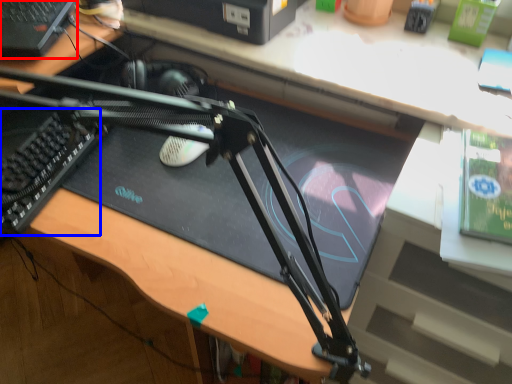
Question: Which object appears farthest to the camera in this image, computer (highlighted by a red box) or laptop keyboard (highlighted by a blue box)?

Choices:
 (A) computer
 (B) laptop keyboard

Answer: (A)